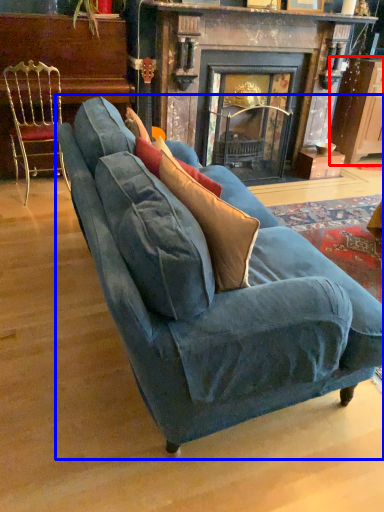
Question: Which of the following is the closest to the observer, cabinetry (highlighted by a red box) or studio couch (highlighted by a blue box)?

Choices:
 (A) cabinetry
 (B) studio couch

Answer: (B)